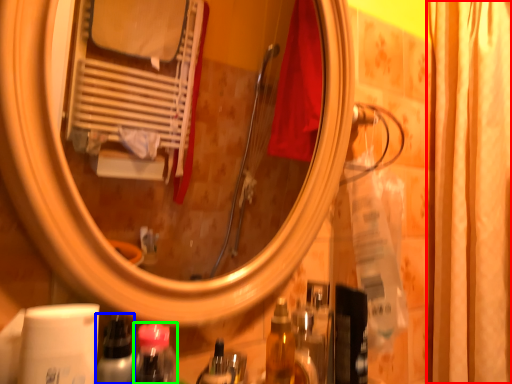
Question: Which is farther away from shower curtain (highlighted by a red box)? bottle (highlighted by a blue box) or mouthwash (highlighted by a green box)?

Choices:
 (A) bottle
 (B) mouthwash

Answer: (A)